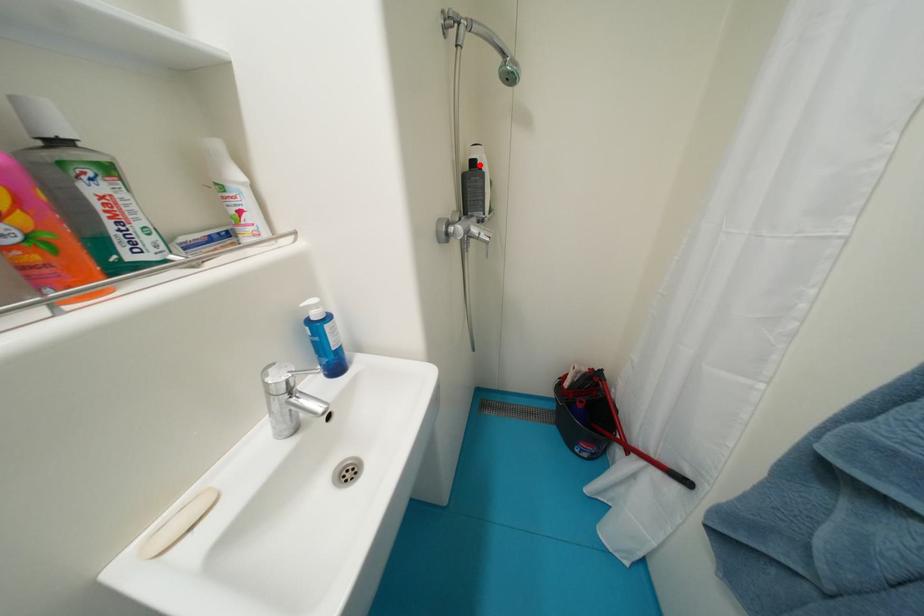
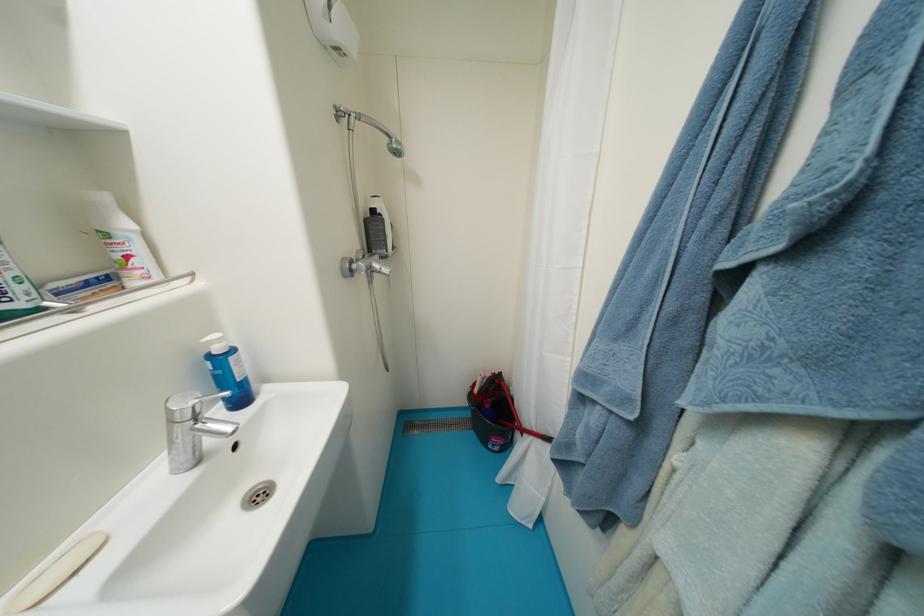
The point at the highlighted location is marked in the first image. Where is the corresponding point in the second image?

(380, 214)